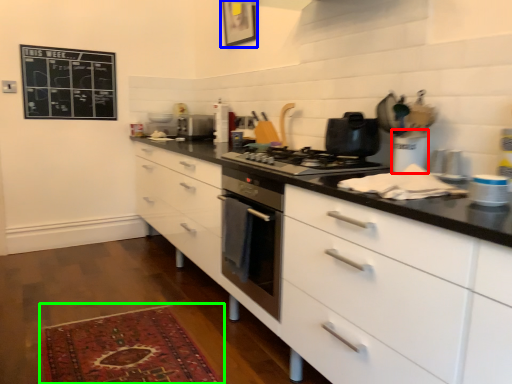
Question: Based on their relative distances, which object is farther from appliance (highlighted by a red box)? Choose from picture frame (highlighted by a blue box) and mat (highlighted by a green box).

Choices:
 (A) picture frame
 (B) mat

Answer: (A)